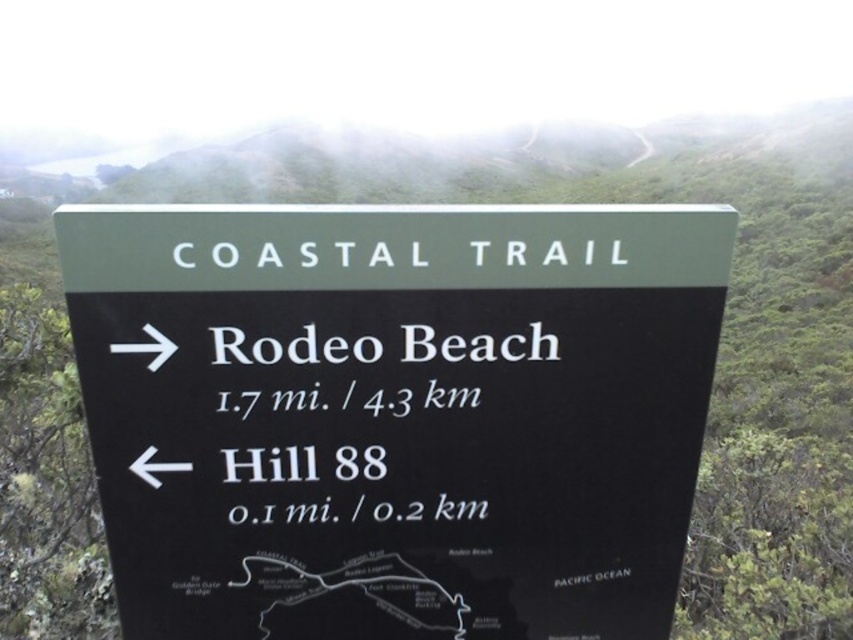
You are standing in front of the Coastal Trail signboard and want to determine which of the two points, point (x=236, y=547) or point (x=495, y=353), is closer to you. Based on the signboard layout, which point is nearer?

Point (x=236, y=547) is further to the viewer than point (x=495, y=353), so the closer point is point (x=495, y=353).